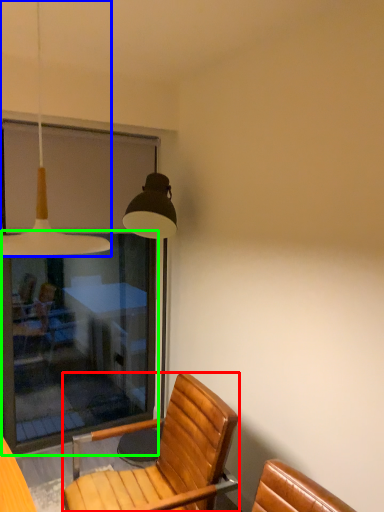
Question: Which object is positioned farthest from chair (highlighted by a red box)? Select from lamp (highlighted by a blue box) and screen door (highlighted by a green box).

Choices:
 (A) lamp
 (B) screen door

Answer: (B)